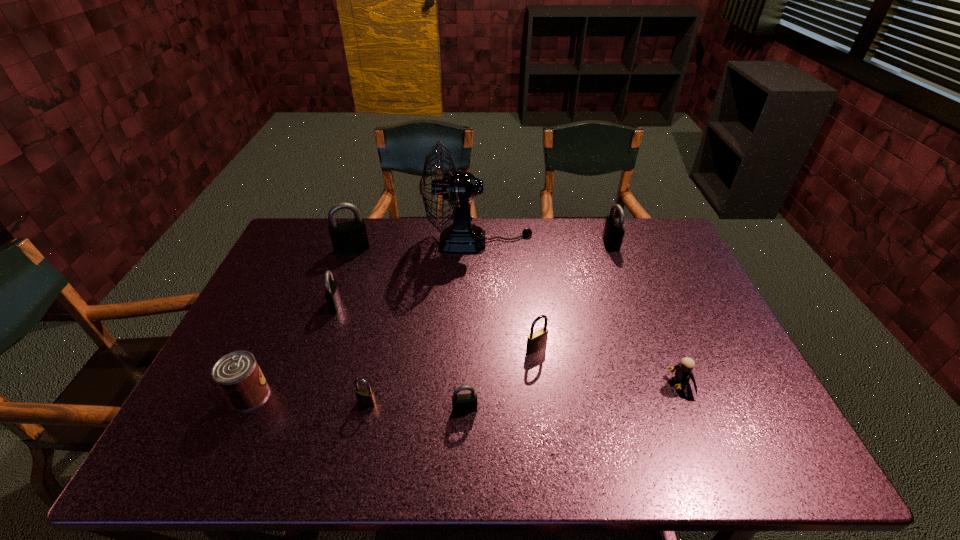
Locate an element on the screen. The height and width of the screenshot is (540, 960). vacant region between the biggest black padlock and the black fan is located at coordinates (416, 245).

The height and width of the screenshot is (540, 960). In order to click on vacant space that is in between the smallest black padlock and the rightmost black padlock in this screenshot , I will do `click(538, 327)`.

The width and height of the screenshot is (960, 540). I want to click on empty location between the can and the tallest padlock, so click(300, 322).

Where is `vacant region between the black fan and the fourth farthest padlock`? The height and width of the screenshot is (540, 960). vacant region between the black fan and the fourth farthest padlock is located at coordinates (508, 295).

Image resolution: width=960 pixels, height=540 pixels. Find the location of `vacant region between the third farthest padlock and the Lego`. vacant region between the third farthest padlock and the Lego is located at coordinates (508, 345).

Locate which object ranks sixth in proximity to the nearest black padlock. Please provide its 2D coordinates. Your answer should be formatted as a tuple, i.e. [(x, y)], where the tuple contains the x and y coordinates of a point satisfying the conditions above.

[(459, 188)]

Point out which object is positioned as the nearest to the sixth nearest object. Please provide its 2D coordinates. Your answer should be formatted as a tuple, i.e. [(x, y)], where the tuple contains the x and y coordinates of a point satisfying the conditions above.

[(349, 237)]

Select which padlock is the third closest to the smaller brass padlock. Please provide its 2D coordinates. Your answer should be formatted as a tuple, i.e. [(x, y)], where the tuple contains the x and y coordinates of a point satisfying the conditions above.

[(537, 340)]

The width and height of the screenshot is (960, 540). I want to click on padlock that stands as the fifth closest to the Lego, so click(332, 294).

Identify the location of black padlock that stands as the second closest to the second tallest object. (464, 403).